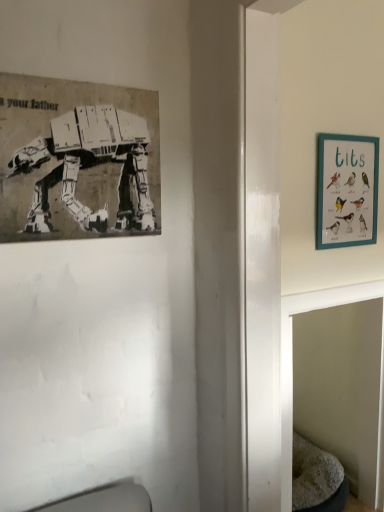
Question: Does teal wooden picture frame at upper right, which is the 2th picture frame from left to right, appear on the left side of black paper poster at upper left, acting as the 1th picture frame starting from the left?

Choices:
 (A) no
 (B) yes

Answer: (A)

Question: From a real-world perspective, is teal wooden picture frame at upper right, arranged as the first picture frame when viewed from the back, on black paper poster at upper left, the second picture frame viewed from the back?

Choices:
 (A) yes
 (B) no

Answer: (B)

Question: Can you confirm if teal wooden picture frame at upper right, arranged as the first picture frame when viewed from the back, is wider than black paper poster at upper left, the second picture frame viewed from the back?

Choices:
 (A) yes
 (B) no

Answer: (B)

Question: Can you confirm if teal wooden picture frame at upper right, arranged as the first picture frame when viewed from the back, is thinner than black paper poster at upper left, acting as the 1th picture frame starting from the left?

Choices:
 (A) yes
 (B) no

Answer: (A)

Question: Is teal wooden picture frame at upper right, the first picture frame positioned from the right, oriented towards black paper poster at upper left, the second picture frame viewed from the back?

Choices:
 (A) no
 (B) yes

Answer: (A)

Question: Would you say black paper poster at upper left, acting as the 1th picture frame starting from the left, is to the left or to the right of teal wooden picture frame at upper right, arranged as the first picture frame when viewed from the back, in the picture?

Choices:
 (A) right
 (B) left

Answer: (B)

Question: Relative to teal wooden picture frame at upper right, acting as the 2th picture frame starting from the front, is black paper poster at upper left, the second picture frame viewed from the back, in front or behind?

Choices:
 (A) behind
 (B) front

Answer: (B)

Question: From a real-world perspective, relative to teal wooden picture frame at upper right, acting as the 2th picture frame starting from the front, is black paper poster at upper left, marked as the 1th picture frame in a front-to-back arrangement, vertically above or below?

Choices:
 (A) below
 (B) above

Answer: (B)

Question: From the image's perspective, is black paper poster at upper left, acting as the 1th picture frame starting from the left, above or below teal wooden picture frame at upper right, arranged as the first picture frame when viewed from the back?

Choices:
 (A) above
 (B) below

Answer: (A)

Question: Would you say teal wooden picture frame at upper right, acting as the 2th picture frame starting from the front, is inside or outside black paper poster at upper left, acting as the 1th picture frame starting from the left?

Choices:
 (A) outside
 (B) inside

Answer: (A)

Question: In terms of size, does teal wooden picture frame at upper right, the first picture frame positioned from the right, appear bigger or smaller than black paper poster at upper left, marked as the 1th picture frame in a front-to-back arrangement?

Choices:
 (A) small
 (B) big

Answer: (A)

Question: Relative to black paper poster at upper left, acting as the 1th picture frame starting from the left, is teal wooden picture frame at upper right, the first picture frame positioned from the right, in front or behind?

Choices:
 (A) behind
 (B) front

Answer: (A)

Question: Is teal wooden picture frame at upper right, acting as the 2th picture frame starting from the front, to the left or to the right of black paper poster at upper left, the second picture frame viewed from the back, in the image?

Choices:
 (A) left
 (B) right

Answer: (B)

Question: Considering the positions of teal wooden picture frame at upper right, which is the 2th picture frame from left to right, and gray fabric cat bed at lower right in the image, is teal wooden picture frame at upper right, which is the 2th picture frame from left to right, wider or thinner than gray fabric cat bed at lower right?

Choices:
 (A) thin
 (B) wide

Answer: (A)

Question: Considering the positions of teal wooden picture frame at upper right, acting as the 2th picture frame starting from the front, and gray fabric cat bed at lower right in the image, is teal wooden picture frame at upper right, acting as the 2th picture frame starting from the front, bigger or smaller than gray fabric cat bed at lower right?

Choices:
 (A) small
 (B) big

Answer: (A)